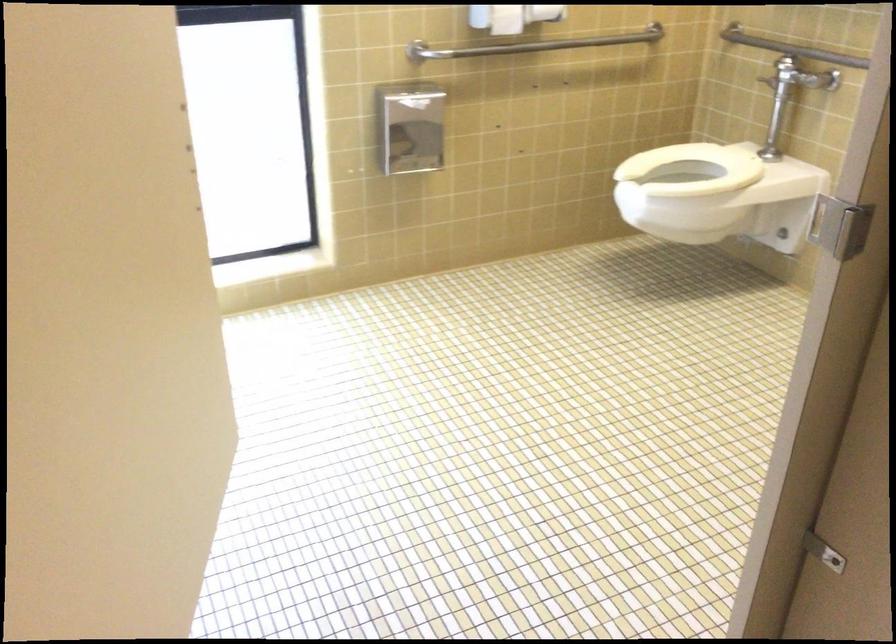
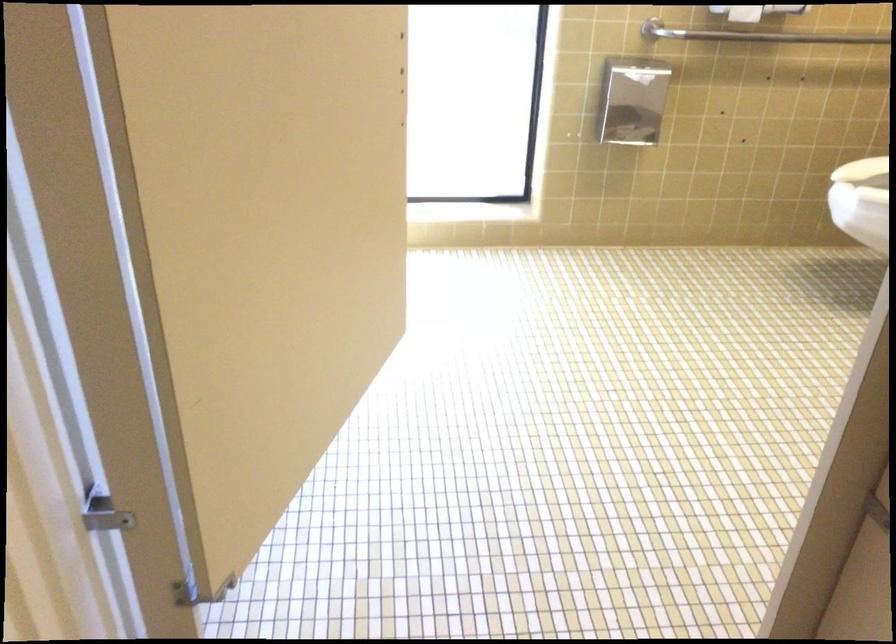
Question: The camera is either moving clockwise (left) or counter-clockwise (right) around the object. The first image is from the beginning of the video and the second image is from the end. Is the camera moving left or right when shooting the video?

Choices:
 (A) Left
 (B) Right

Answer: (B)